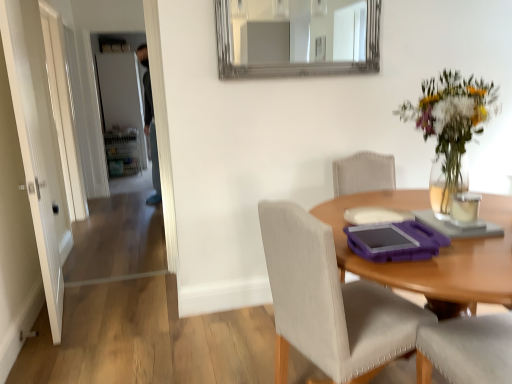
Question: Can you confirm if white glossy door at left, the first door in the right-to-left sequence, is bigger than wooden table at center?

Choices:
 (A) yes
 (B) no

Answer: (A)

Question: Is white glossy door at left, which is the first door in front-to-back order, directly adjacent to wooden table at center?

Choices:
 (A) no
 (B) yes

Answer: (A)

Question: Is wooden table at center at the back of white glossy door at left, which is the first door in front-to-back order?

Choices:
 (A) yes
 (B) no

Answer: (B)

Question: Is white glossy door at left, arranged as the second door when viewed from the back, outside of wooden table at center?

Choices:
 (A) no
 (B) yes

Answer: (B)

Question: Is the depth of white glossy door at left, the first door in the right-to-left sequence, less than that of wooden table at center?

Choices:
 (A) yes
 (B) no

Answer: (B)

Question: Which is correct: white matte door at upper left, the 1th door from the left, is inside wooden table at center, or outside of it?

Choices:
 (A) inside
 (B) outside

Answer: (B)

Question: Considering the positions of white matte door at upper left, the second door when ordered from right to left, and wooden table at center in the image, is white matte door at upper left, the second door when ordered from right to left, wider or thinner than wooden table at center?

Choices:
 (A) thin
 (B) wide

Answer: (A)

Question: Is point (145, 162) closer or farther from the camera than point (464, 309)?

Choices:
 (A) farther
 (B) closer

Answer: (A)

Question: Is white matte door at upper left, the 2th door from the front, taller or shorter than wooden table at center?

Choices:
 (A) short
 (B) tall

Answer: (B)

Question: Is silver-framed mirror at upper center spatially inside white glossy door at left, or outside of it?

Choices:
 (A) inside
 (B) outside

Answer: (B)

Question: Considering their positions, is silver-framed mirror at upper center located in front of or behind white glossy door at left?

Choices:
 (A) front
 (B) behind

Answer: (A)

Question: Is silver-framed mirror at upper center to the left or to the right of white glossy door at left in the image?

Choices:
 (A) left
 (B) right

Answer: (B)

Question: Is point (332, 46) closer or farther from the camera than point (71, 119)?

Choices:
 (A) closer
 (B) farther

Answer: (A)

Question: Is clear glass candle at upper right wider or thinner than matte purple tray at center?

Choices:
 (A) wide
 (B) thin

Answer: (B)

Question: Would you say clear glass candle at upper right is to the left or to the right of matte purple tray at center in the picture?

Choices:
 (A) right
 (B) left

Answer: (A)